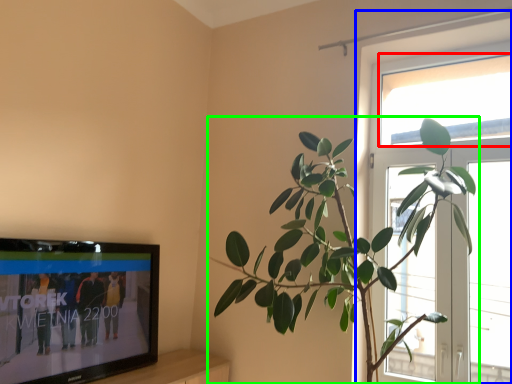
Question: Which object is positioned closest to window screen (highlighted by a red box)? Select from window (highlighted by a blue box) and houseplant (highlighted by a green box).

Choices:
 (A) window
 (B) houseplant

Answer: (A)